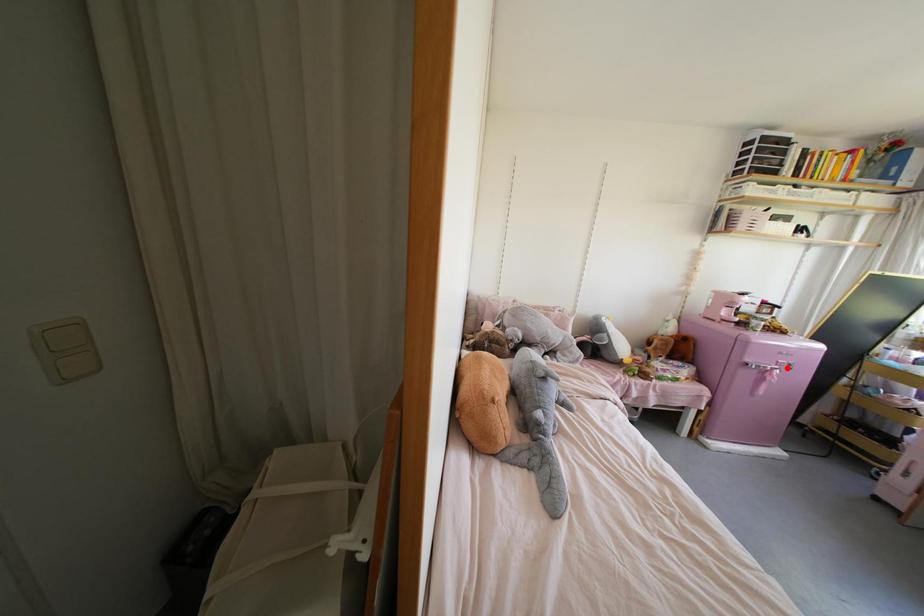
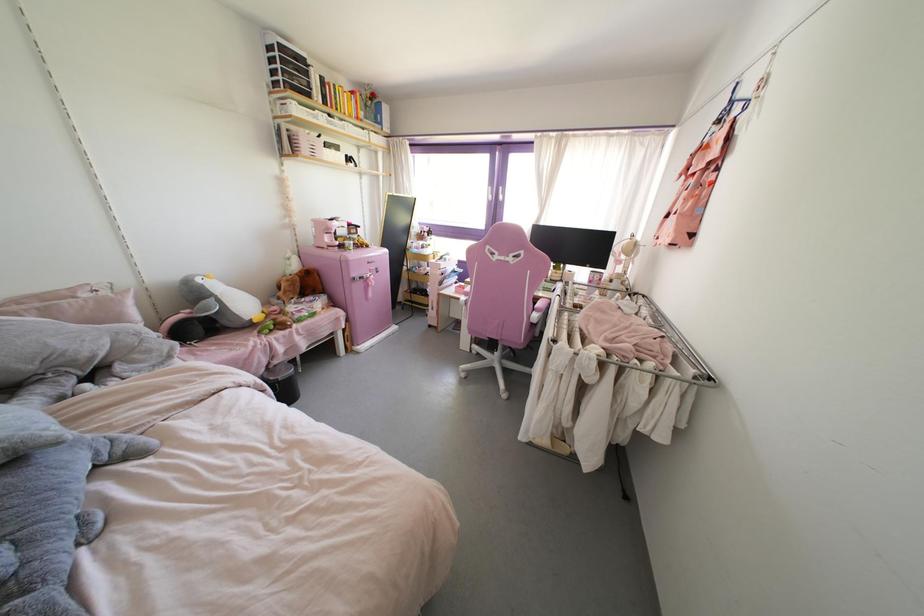
Find the pixel in the second image that matches the highlighted location in the first image.

(377, 272)